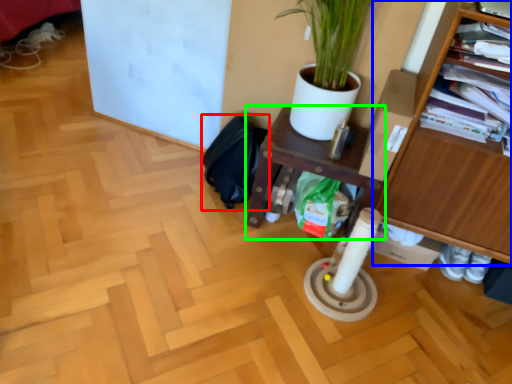
Question: Based on their relative distances, which object is farther from swivel chair (highlighted by a red box)? Choose from furniture (highlighted by a blue box) and shelf (highlighted by a green box).

Choices:
 (A) furniture
 (B) shelf

Answer: (A)